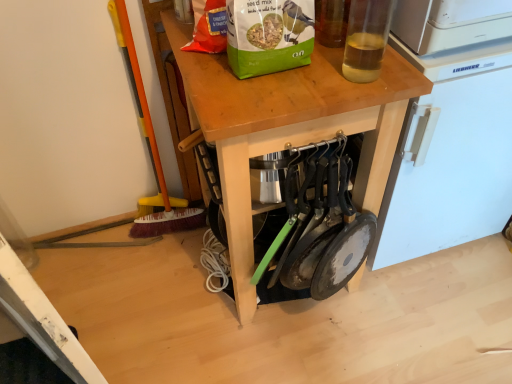
Locate an element on the screen. vacant space that's between translucent glass bottle at upper right and green matte paper bag at upper center is located at coordinates (310, 76).